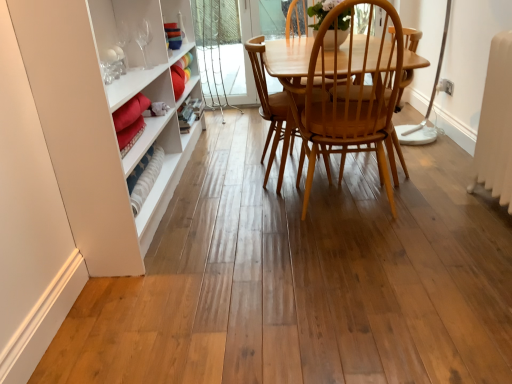
At what (x,y) coordinates should I click in order to perform the action: click on vacant space situated on the left part of light brown wood chair at center. Please return your answer as a coordinate pair (x, y). The height and width of the screenshot is (384, 512). Looking at the image, I should click on (230, 221).